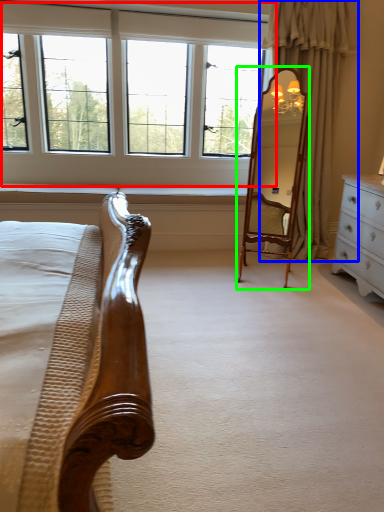
Question: Which object is positioned closest to window (highlighted by a red box)? Select from curtain (highlighted by a blue box) and mirror (highlighted by a green box).

Choices:
 (A) curtain
 (B) mirror

Answer: (A)